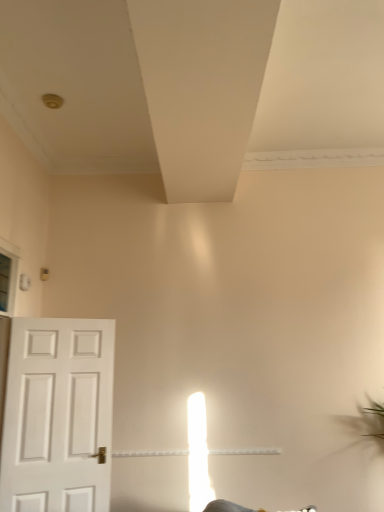
Question: Is white matte door at left wider or thinner than white matte exhaust hood at upper center?

Choices:
 (A) wide
 (B) thin

Answer: (B)

Question: Based on their positions, is white matte door at left located to the left or right of white matte exhaust hood at upper center?

Choices:
 (A) left
 (B) right

Answer: (A)

Question: Is white matte door at left inside or outside of white matte exhaust hood at upper center?

Choices:
 (A) inside
 (B) outside

Answer: (B)

Question: Considering the relative positions of white matte exhaust hood at upper center and white matte door at left in the image provided, is white matte exhaust hood at upper center to the left or to the right of white matte door at left?

Choices:
 (A) right
 (B) left

Answer: (A)

Question: In terms of width, does white matte exhaust hood at upper center look wider or thinner when compared to white matte door at left?

Choices:
 (A) thin
 (B) wide

Answer: (B)

Question: Considering the positions of point pyautogui.click(x=210, y=141) and point pyautogui.click(x=94, y=428), is point pyautogui.click(x=210, y=141) closer or farther from the camera than point pyautogui.click(x=94, y=428)?

Choices:
 (A) farther
 (B) closer

Answer: (B)

Question: From the image's perspective, is white matte exhaust hood at upper center above or below white matte door at left?

Choices:
 (A) above
 (B) below

Answer: (A)